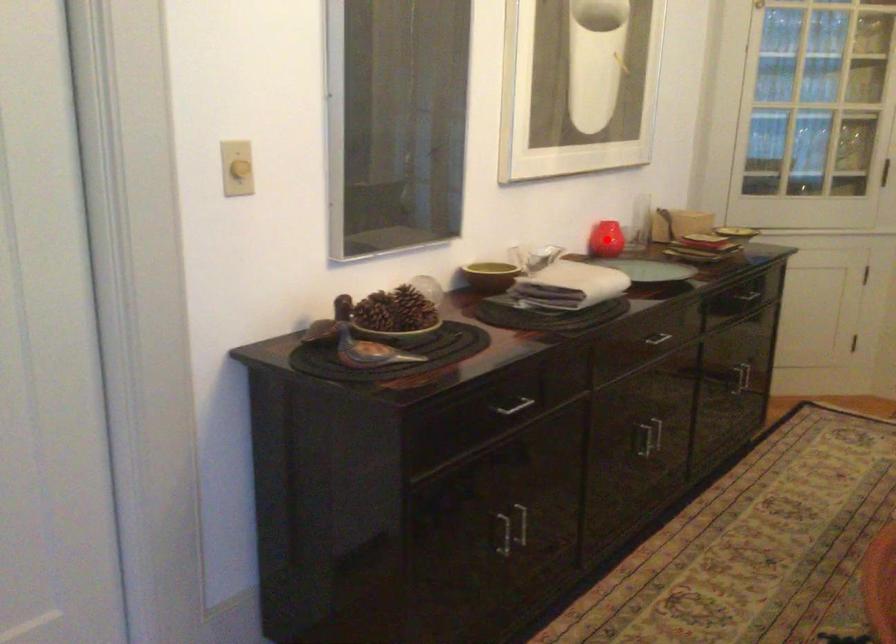
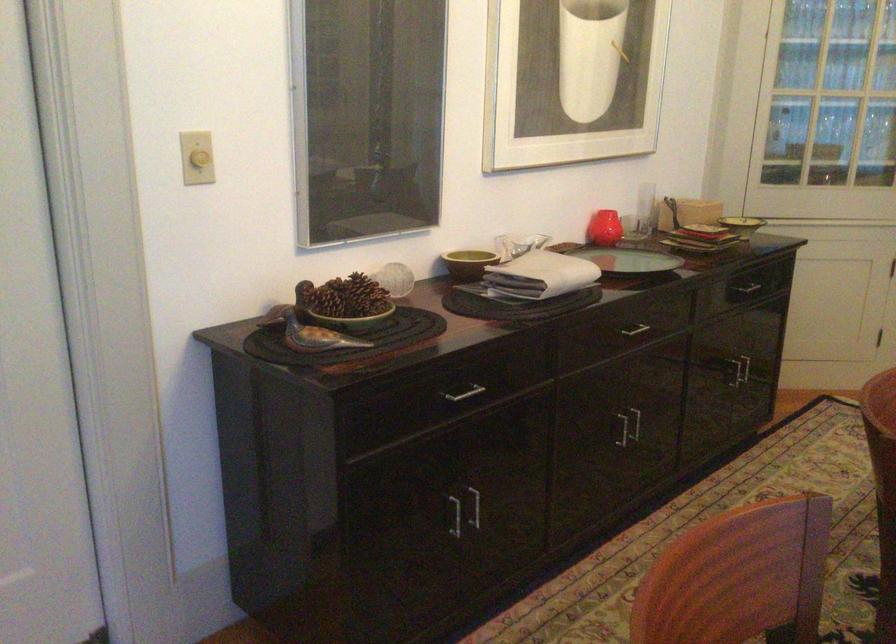
Find the pixel in the second image that matches the highlighted location in the first image.

(604, 228)